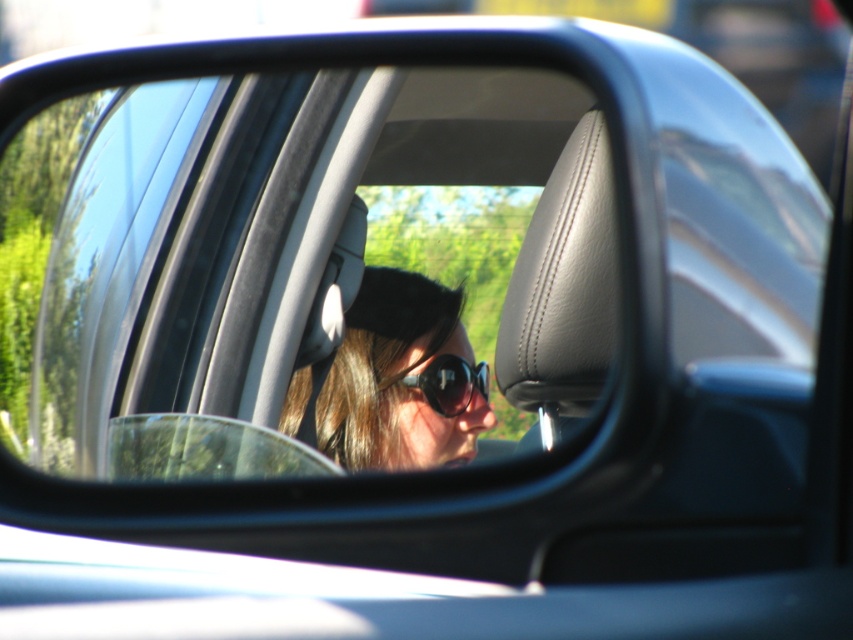
Question: Which of the following is the farthest from the observer?

Choices:
 (A) (165, 461)
 (B) (293, 120)
 (C) (364, 340)
 (D) (480, 365)

Answer: (D)

Question: Does transparent glass car window at center appear over clear glass car mirror at center?

Choices:
 (A) yes
 (B) no

Answer: (A)

Question: Among these objects, which one is farthest from the camera?

Choices:
 (A) transparent glass car window at center
 (B) clear glass car mirror at center
 (C) sunglasses at center

Answer: (C)

Question: Does clear glass car mirror at center have a lesser width compared to black plastic sunglasses at center?

Choices:
 (A) yes
 (B) no

Answer: (B)

Question: Which is nearer to the transparent glass car window at center?

Choices:
 (A) clear glass car mirror at center
 (B) black plastic sunglasses at center

Answer: (A)

Question: Does clear glass car mirror at center appear on the left side of black plastic sunglasses at center?

Choices:
 (A) no
 (B) yes

Answer: (B)